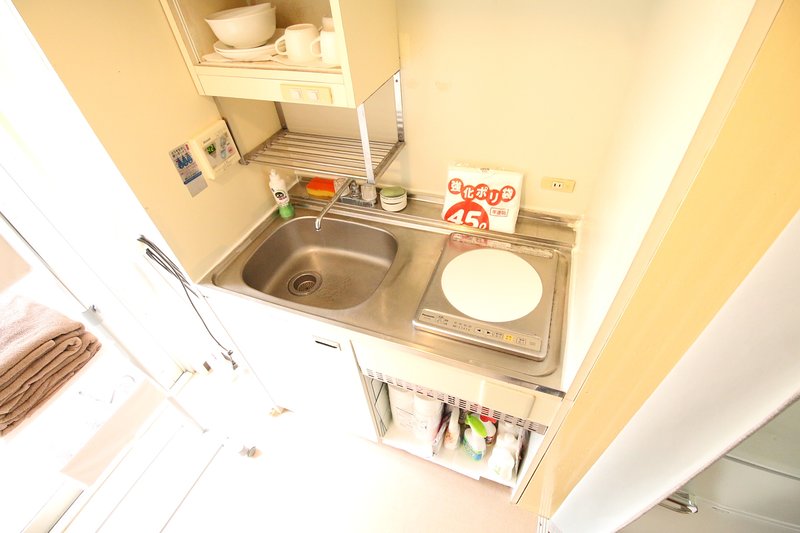
Locate an element on the screen. sponge is located at coordinates (320, 183).